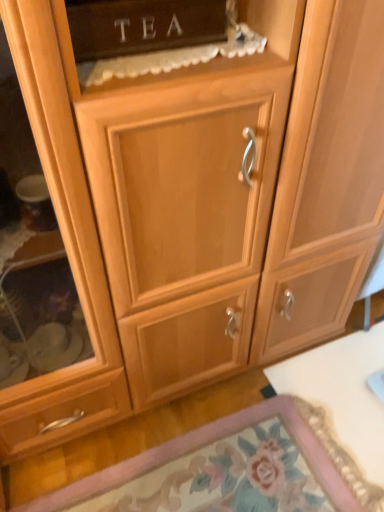
The height and width of the screenshot is (512, 384). Find the location of `vacant region above wooden cabinet door at lower center (from a real-world perspective)`. vacant region above wooden cabinet door at lower center (from a real-world perspective) is located at coordinates (252, 464).